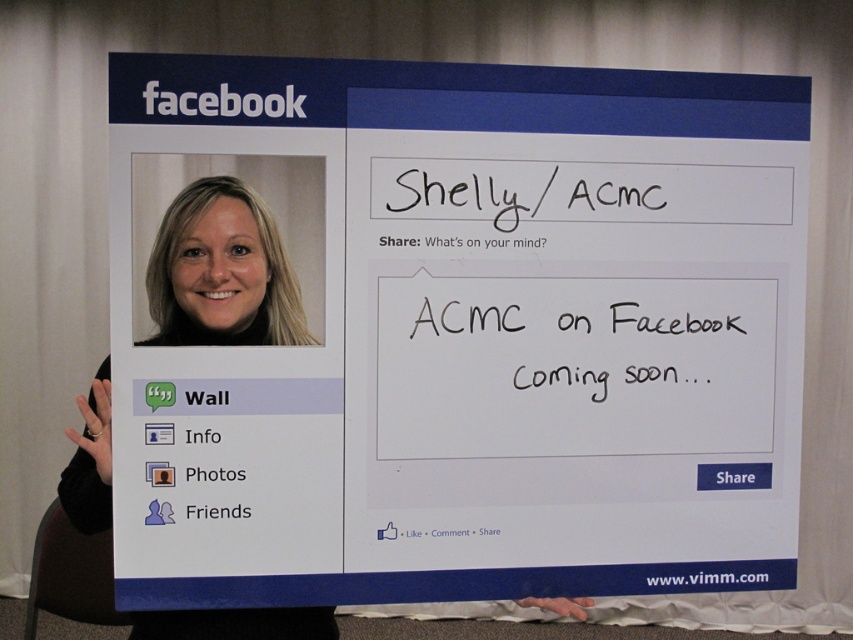
Question: Which of the following is the farthest from the observer?

Choices:
 (A) (224, 317)
 (B) (538, 276)

Answer: (B)

Question: In this image, where is white paperboard at center located relative to blonde hair at left?

Choices:
 (A) below
 (B) above

Answer: (B)

Question: Is white paperboard at center wider than blonde hair at left?

Choices:
 (A) no
 (B) yes

Answer: (B)

Question: Is white paperboard at center wider than blonde hair at left?

Choices:
 (A) yes
 (B) no

Answer: (A)